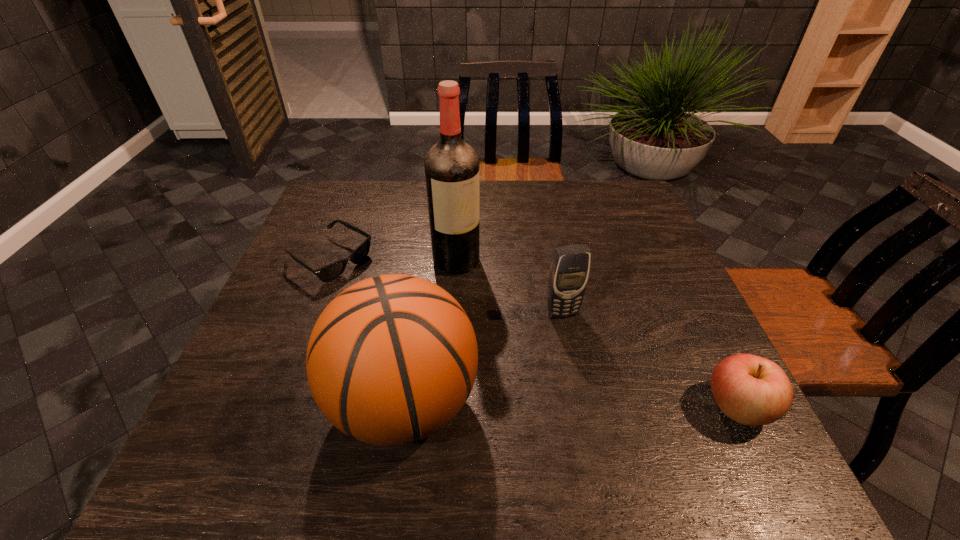
Identify the location of vacant area that lies between the liquor and the shortest object. The image size is (960, 540). (394, 260).

This screenshot has height=540, width=960. In order to click on free point between the rightmost object and the tallest object in this screenshot , I will do `click(597, 334)`.

This screenshot has width=960, height=540. I want to click on free space between the third tallest object and the apple, so click(650, 360).

Where is `free space between the rightmost object and the second tallest object`? The width and height of the screenshot is (960, 540). free space between the rightmost object and the second tallest object is located at coordinates (571, 404).

The width and height of the screenshot is (960, 540). What are the coordinates of `empty location between the liquor and the third shortest object` in the screenshot? It's located at (509, 287).

Where is `vacant space in between the apple and the fourth object from left to right`? The width and height of the screenshot is (960, 540). vacant space in between the apple and the fourth object from left to right is located at coordinates (650, 360).

Find the location of `free space between the second object from right to left and the tallest object`. free space between the second object from right to left and the tallest object is located at coordinates (509, 287).

The height and width of the screenshot is (540, 960). Find the location of `free space between the second shortest object and the shortest object`. free space between the second shortest object and the shortest object is located at coordinates (534, 333).

Locate which object ranks in proximity to the sunglasses. Please provide its 2D coordinates. Your answer should be formatted as a tuple, i.e. [(x, y)], where the tuple contains the x and y coordinates of a point satisfying the conditions above.

[(451, 166)]

The height and width of the screenshot is (540, 960). What are the coordinates of `object that stands as the fourth closest to the second tallest object` in the screenshot? It's located at (751, 390).